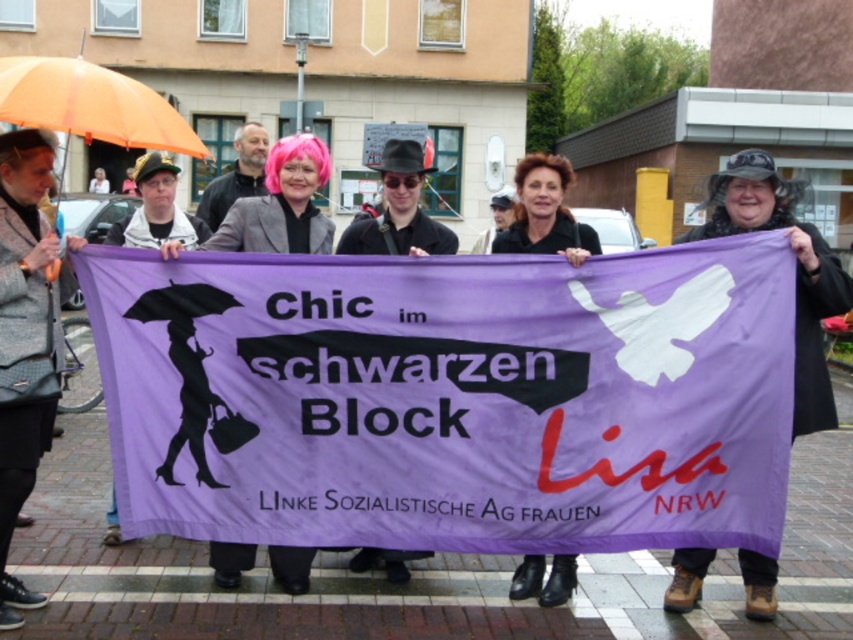
You are a photographer trying to capture a closeup of the orange fabric umbrella at upper left and the matte black jacket at center. Which object should you zoom in on to ensure both are in frame without moving the camera?

The orange fabric umbrella at upper left is larger in size compared to the matte black jacket at center, so you should zoom in on the orange fabric umbrella at upper left to ensure both are in frame without moving the camera.